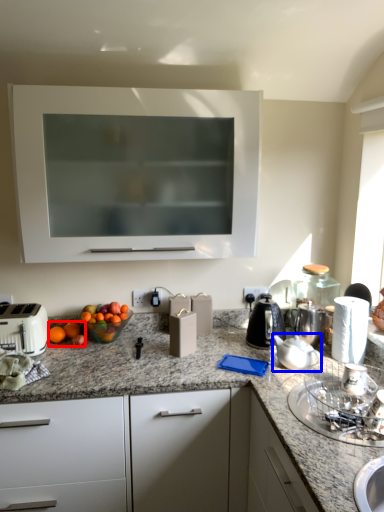
Question: Which point is further to the camera, citrus fruit (highlighted by a red box) or tea pot (highlighted by a blue box)?

Choices:
 (A) citrus fruit
 (B) tea pot

Answer: (A)